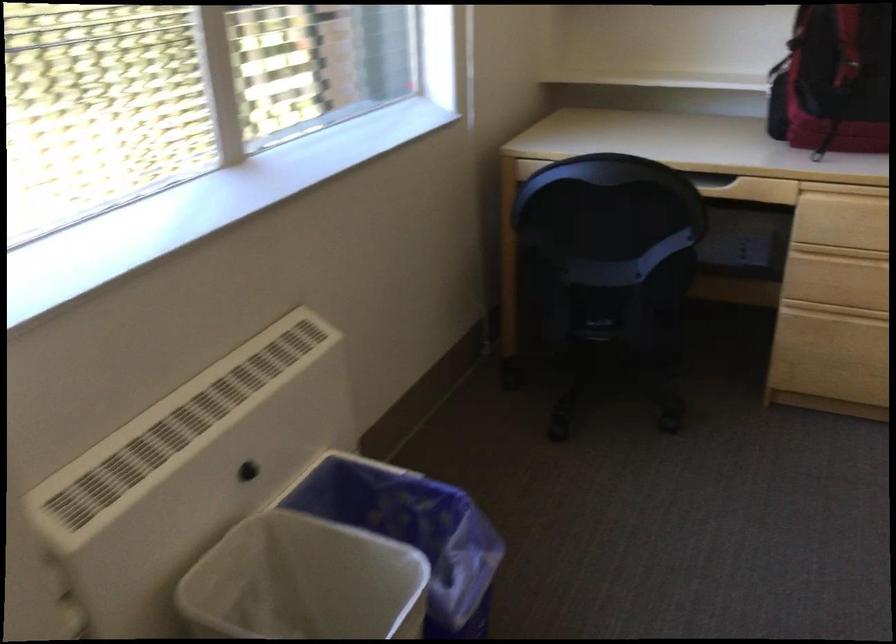
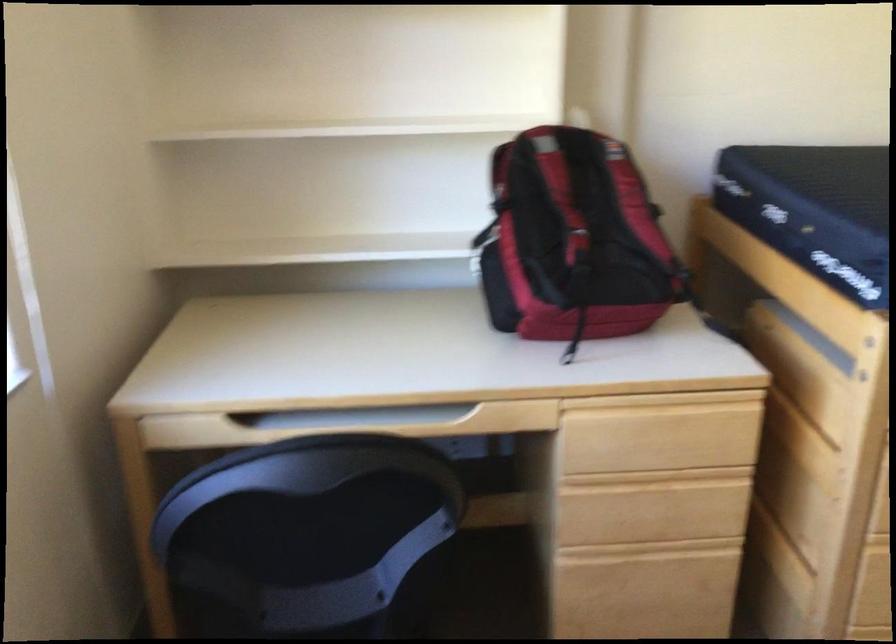
Find the pixel in the second image that matches point (607, 234) in the first image.

(317, 544)